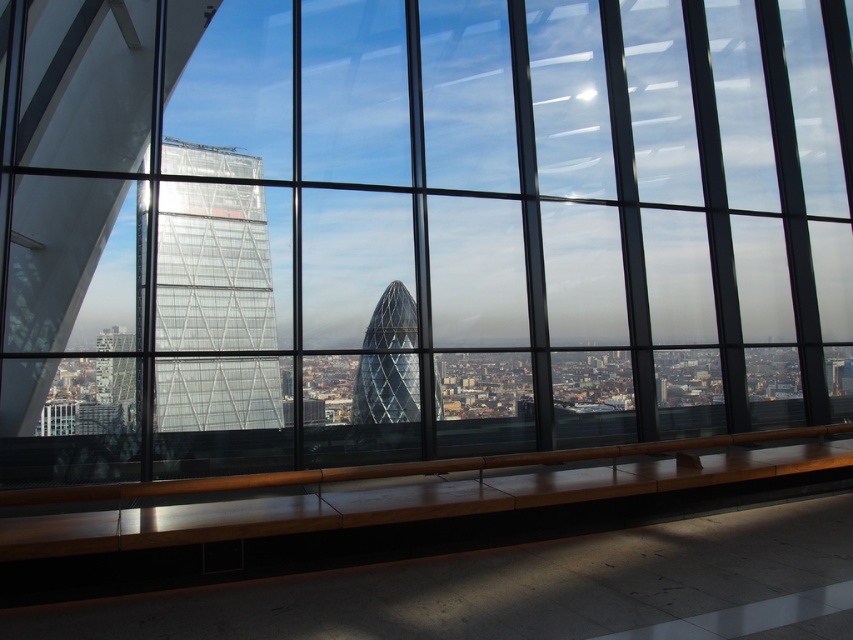
Can you confirm if transparent glass tower at left is positioned above glassy steel tower at center?

Correct, transparent glass tower at left is located above glassy steel tower at center.

Is transparent glass tower at left shorter than glassy steel tower at center?

Incorrect, transparent glass tower at left's height does not fall short of glassy steel tower at center's.

Measure the distance between transparent glass tower at left and camera.

The distance of transparent glass tower at left from camera is 5.70 meters.

The height and width of the screenshot is (640, 853). Find the location of `transparent glass tower at left`. transparent glass tower at left is located at coordinates (212, 268).